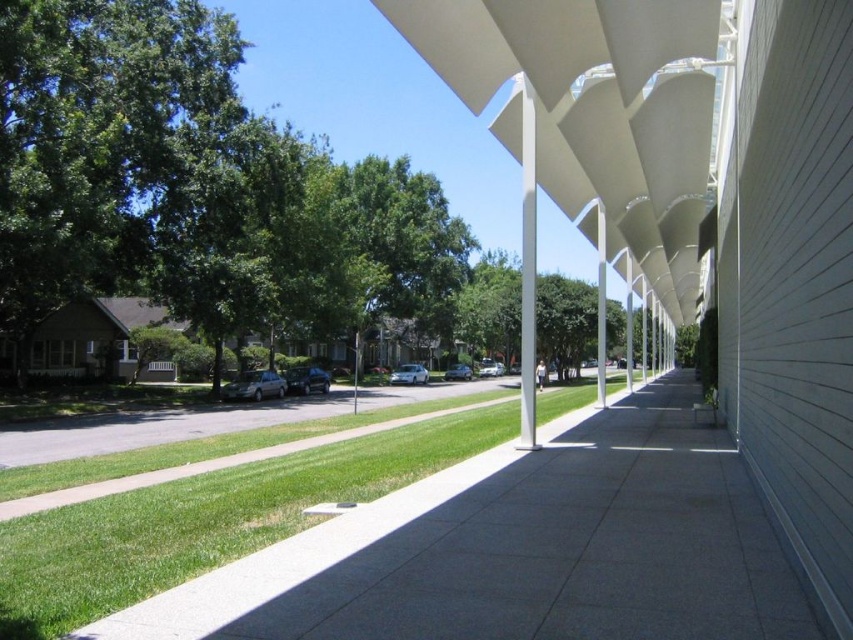
Who is taller, white matte awning at center or green grass at center?

white matte awning at center is taller.

Is white matte awning at center smaller than green grass at center?

Incorrect, white matte awning at center is not smaller in size than green grass at center.

Who is more distant from viewer, (643, 216) or (436, 436)?

The point (643, 216) is behind.

At what (x,y) coordinates should I click in order to perform the action: click on white matte awning at center. Please return your answer as a coordinate pair (x, y). The image size is (853, 640). Looking at the image, I should click on (593, 108).